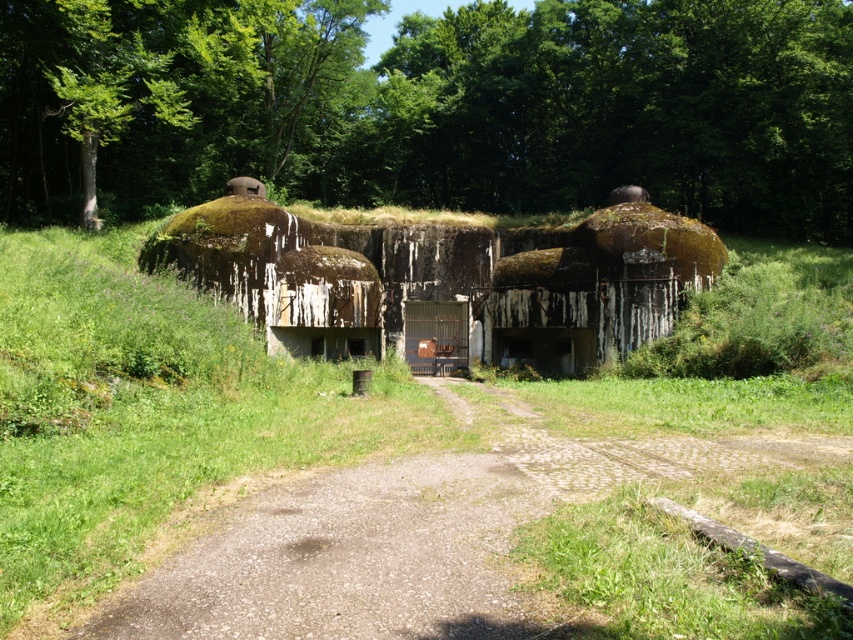
You are a hiker who wants to take a photo of the dirt road at center from the green leafy tree at upper center. Is the tree tall enough to provide a good vantage point for this photo?

The green leafy tree at upper center is much taller than the dirt road at center, so yes, the tree is tall enough to provide a good vantage point for taking a photo of the dirt road at center.

You are standing in front of the bunker and want to take a photo. There are two points marked on the structure at coordinates point (271, 138) and point (786, 451). Which point is closer to your camera when taking the photo?

Point (271, 138) is further to the camera than point (786, 451), so the point closer to the camera would be point (786, 451).